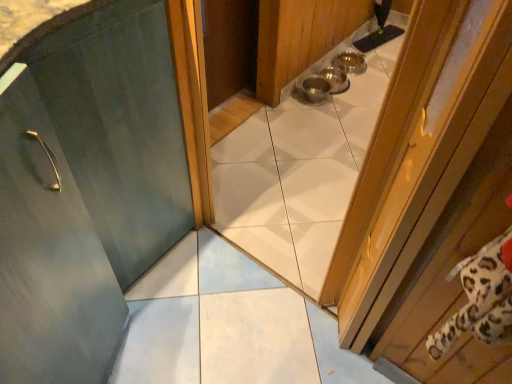
Question: In the image, is wooden door at right, the 1th door positioned from the right, positioned in front of or behind matte green door at center, which appears as the 1th door when viewed from the left?

Choices:
 (A) front
 (B) behind

Answer: (A)

Question: Which is correct: wooden door at right, the second door from the left, is inside matte green door at center, which is the 2th door from right to left, or outside of it?

Choices:
 (A) outside
 (B) inside

Answer: (A)

Question: Is wooden door at right, the second door from the left, taller or shorter than matte green door at center, which is the 2th door from right to left?

Choices:
 (A) tall
 (B) short

Answer: (B)

Question: Is point (54, 89) closer or farther from the camera than point (509, 9)?

Choices:
 (A) closer
 (B) farther

Answer: (B)

Question: Based on their positions, is matte green door at center, which is the 2th door from right to left, located to the left or right of wooden door at right, the 1th door positioned from the right?

Choices:
 (A) right
 (B) left

Answer: (B)

Question: Is matte green door at center, which appears as the 1th door when viewed from the left, inside or outside of wooden door at right, the 1th door positioned from the right?

Choices:
 (A) inside
 (B) outside

Answer: (B)

Question: Looking at their shapes, would you say matte green door at center, which appears as the 1th door when viewed from the left, is wider or thinner than wooden door at right, the second door from the left?

Choices:
 (A) thin
 (B) wide

Answer: (B)